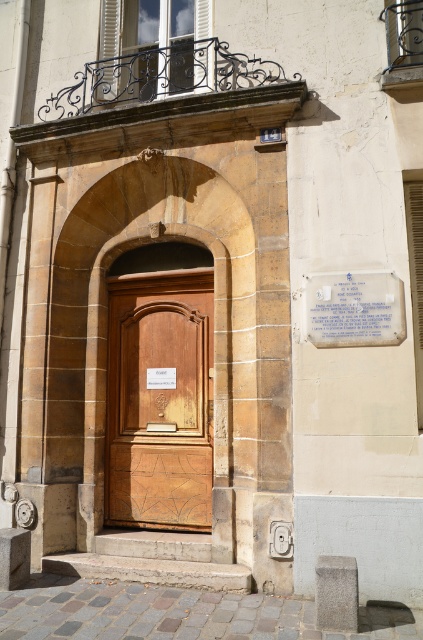
Question: Does wooden carved door at center lie in front of white paper plaque at upper right?

Choices:
 (A) yes
 (B) no

Answer: (B)

Question: Which point is farther to the camera?

Choices:
 (A) (305, 321)
 (B) (131, 344)

Answer: (B)

Question: Which object is closer to the camera taking this photo?

Choices:
 (A) wooden carved door at center
 (B) white paper plaque at upper right

Answer: (B)

Question: Is wooden carved door at center above white paper plaque at upper right?

Choices:
 (A) no
 (B) yes

Answer: (A)

Question: Which point is farther to the camera?

Choices:
 (A) white paper plaque at upper right
 (B) wooden carved door at center

Answer: (B)

Question: Observing the image, what is the correct spatial positioning of wooden carved door at center in reference to white paper plaque at upper right?

Choices:
 (A) below
 (B) above

Answer: (A)